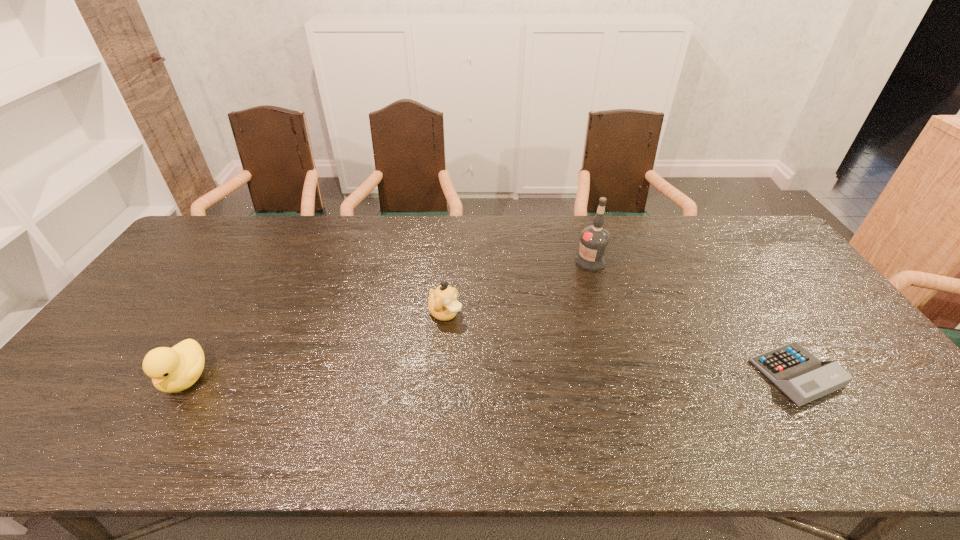
Image resolution: width=960 pixels, height=540 pixels. Identify the location of free area in between the tallest object and the calculator. (693, 318).

The height and width of the screenshot is (540, 960). What are the coordinates of `vacant region between the calculator and the farthest object` in the screenshot? It's located at (693, 318).

This screenshot has height=540, width=960. What are the coordinates of `unoccupied area between the vodka and the leftmost object` in the screenshot? It's located at (388, 320).

Where is `empty space that is in between the leftmost object and the farthest object`? Image resolution: width=960 pixels, height=540 pixels. empty space that is in between the leftmost object and the farthest object is located at coordinates (388, 320).

I want to click on the third closest object to the farthest object, so click(x=175, y=369).

The height and width of the screenshot is (540, 960). What are the coordinates of `the third closest object to the third object from left to right` in the screenshot? It's located at (175, 369).

At what (x,y) coordinates should I click in order to perform the action: click on free space that satisfies the following two spatial constraints: 1. on the back side of the second farthest object; 2. on the right side of the tallest object. Please return your answer as a coordinate pair (x, y). The image size is (960, 540). Looking at the image, I should click on (449, 262).